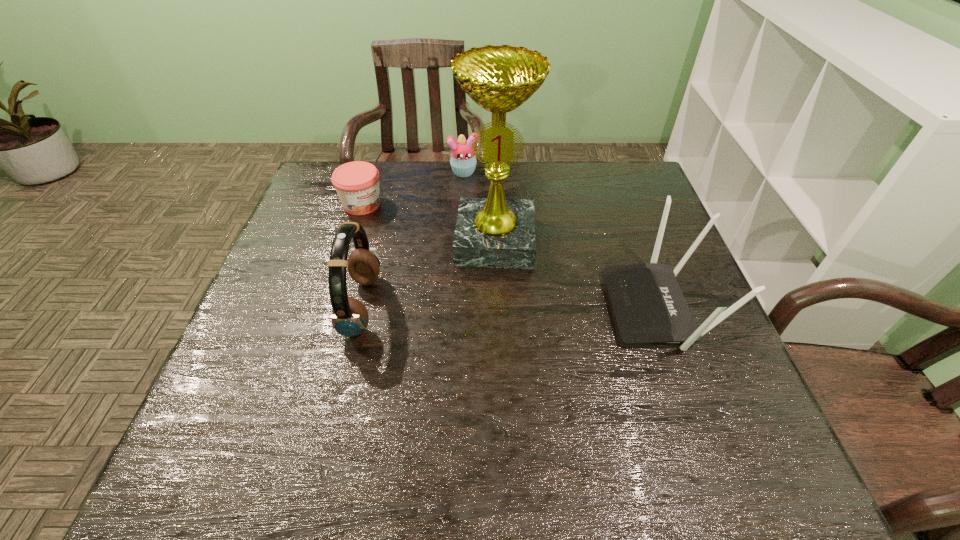
This screenshot has width=960, height=540. In order to click on free location that satisfies the following two spatial constraints: 1. on the back side of the fourth tallest object; 2. on the right side of the jam in this screenshot , I will do `click(372, 172)`.

Locate an element on the screen. The image size is (960, 540). free region that satisfies the following two spatial constraints: 1. on the front side of the router; 2. on the front-facing side of the tallest object is located at coordinates tap(497, 308).

Where is `free space that satisfies the following two spatial constraints: 1. on the front side of the shortest object; 2. on the front-facing side of the rightmost object`? The image size is (960, 540). free space that satisfies the following two spatial constraints: 1. on the front side of the shortest object; 2. on the front-facing side of the rightmost object is located at coordinates (330, 308).

Image resolution: width=960 pixels, height=540 pixels. I want to click on blank space that satisfies the following two spatial constraints: 1. on the front side of the router; 2. on the front-facing side of the farthest object, so click(x=458, y=308).